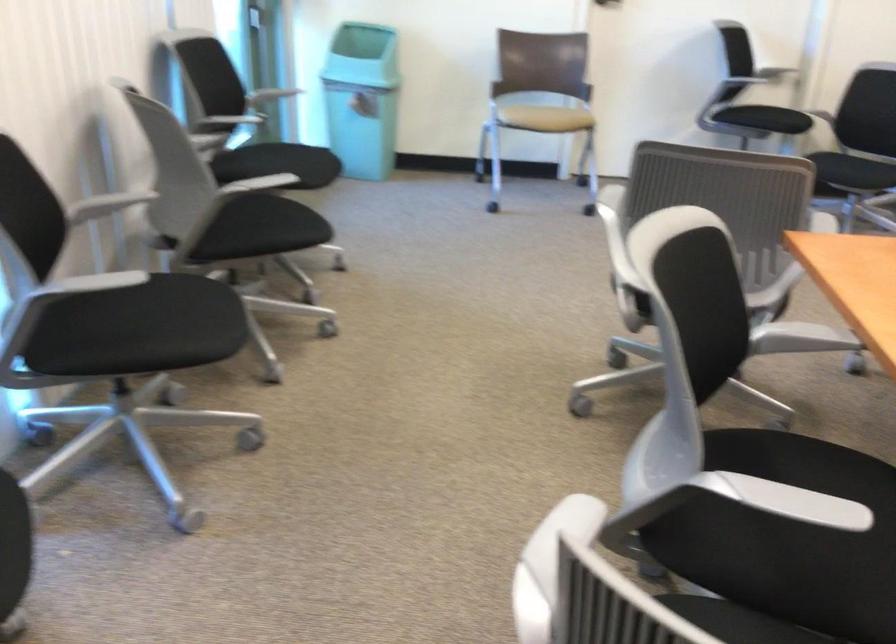
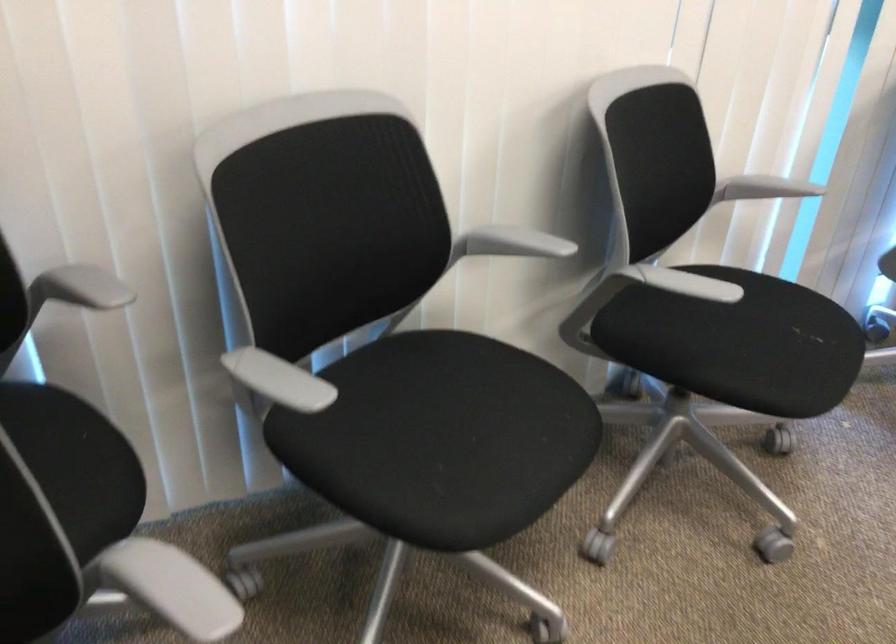
The first image is from the beginning of the video and the second image is from the end. How did the camera likely rotate when shooting the video?

The camera rotated toward left-down.